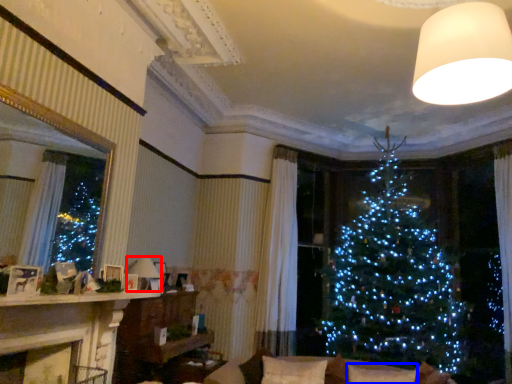
Question: Which object appears farthest to the camera in this image, lamp (highlighted by a red box) or pillow (highlighted by a blue box)?

Choices:
 (A) lamp
 (B) pillow

Answer: (A)